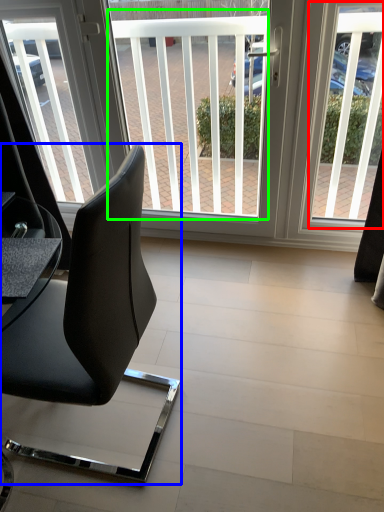
Question: Which is nearer to the window screen (highlighted by a red box)? chair (highlighted by a blue box) or window screen (highlighted by a green box).

Choices:
 (A) chair
 (B) window screen

Answer: (B)